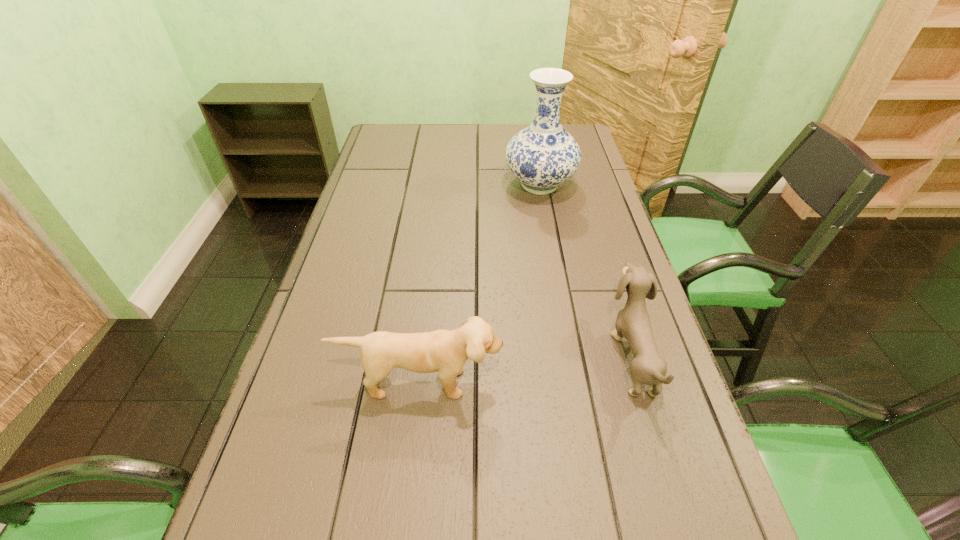
Select which object is the second closest to the left puppy. Please provide its 2D coordinates. Your answer should be formatted as a tuple, i.e. [(x, y)], where the tuple contains the x and y coordinates of a point satisfying the conditions above.

[(542, 156)]

You are a GUI agent. You are given a task and a screenshot of the screen. Output one action in this format:
    pyautogui.click(x=<x>, y=<y>)
    Task: Click on the closest object to the left puppy
    
    Given the screenshot: What is the action you would take?
    [633, 322]